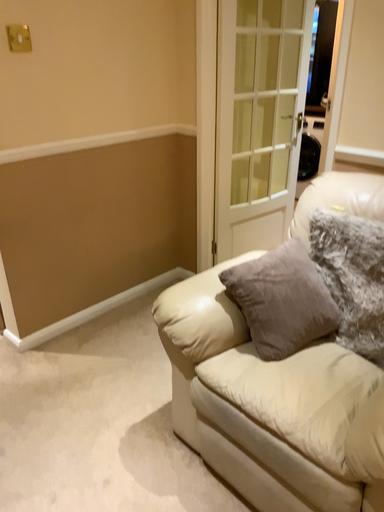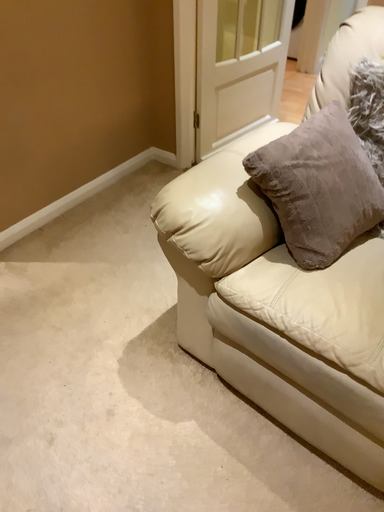
Question: Which way did the camera rotate in the video?

Choices:
 (A) rotated upward
 (B) rotated downward

Answer: (B)